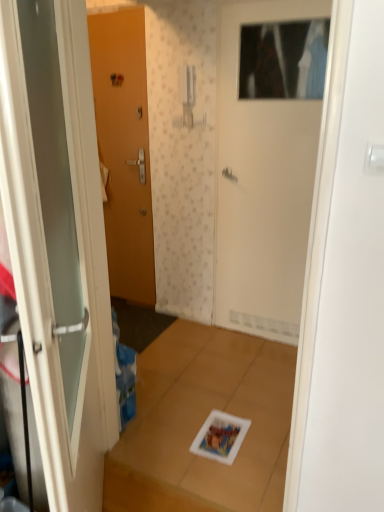
Question: Would you say white glossy door at left, which is the first door from front to back, is to the left or to the right of matte wood door at left, the third door when ordered from right to left, in the picture?

Choices:
 (A) right
 (B) left

Answer: (A)

Question: From the image's perspective, is white glossy door at left, acting as the second door starting from the left, positioned above or below matte wood door at left, which is the third door from front to back?

Choices:
 (A) below
 (B) above

Answer: (A)

Question: Which of these objects is positioned closest to the white matte door at upper center, the 2th door positioned from the front?

Choices:
 (A) matte wood door at left, which is the third door from front to back
 (B) white glossy door at left, the second door viewed from the right

Answer: (A)

Question: Which of these objects is positioned farthest from the white glossy door at left, which is the first door from front to back?

Choices:
 (A) white matte door at upper center, the 3th door positioned from the left
 (B) matte wood door at left, positioned as the first door in back-to-front order

Answer: (B)